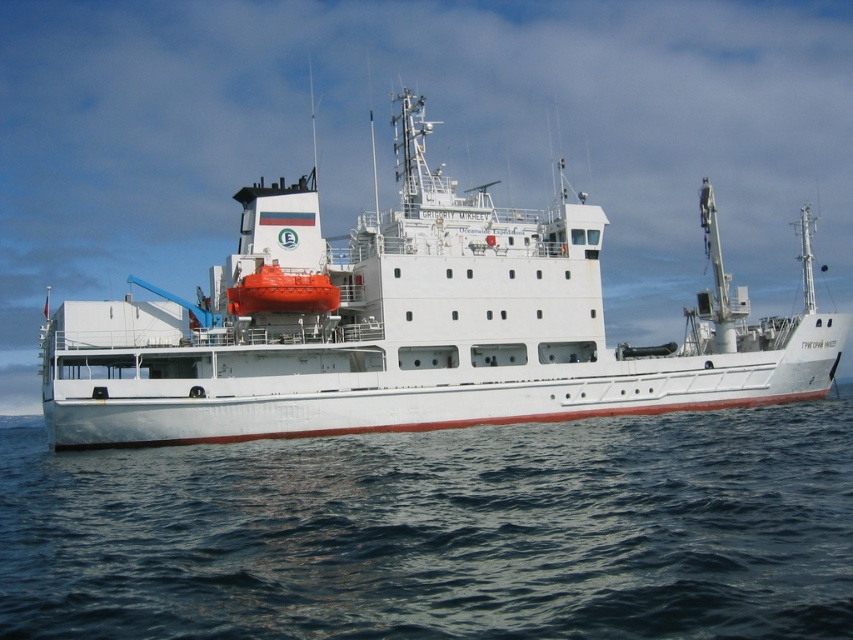
You are an observer on the deck of the white matte ship at center. Looking out, you see the blue water at lower center. In which direction relative to the ship is the blue water located?

The blue water at lower center is positioned on the right side of the white matte ship at center, so it is located to the right of the ship.